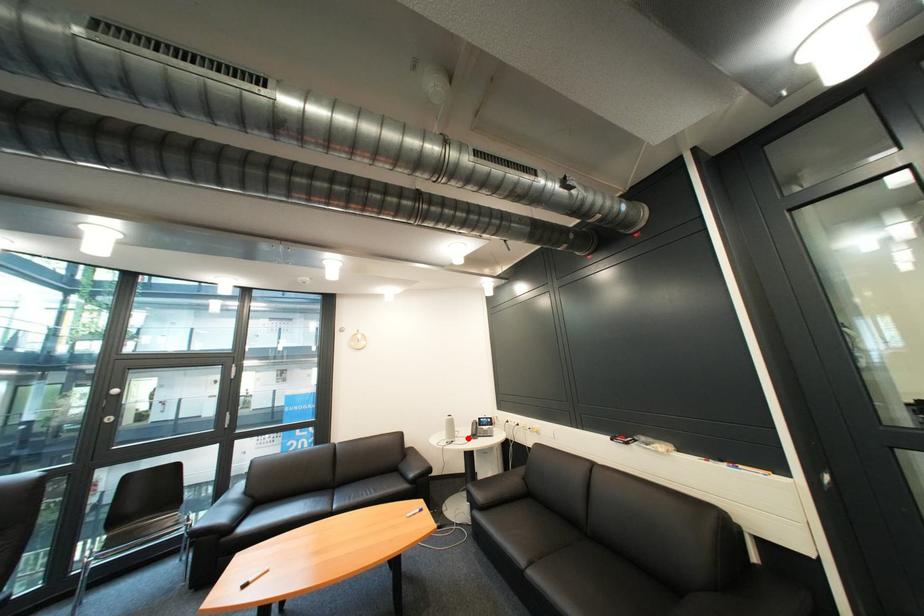
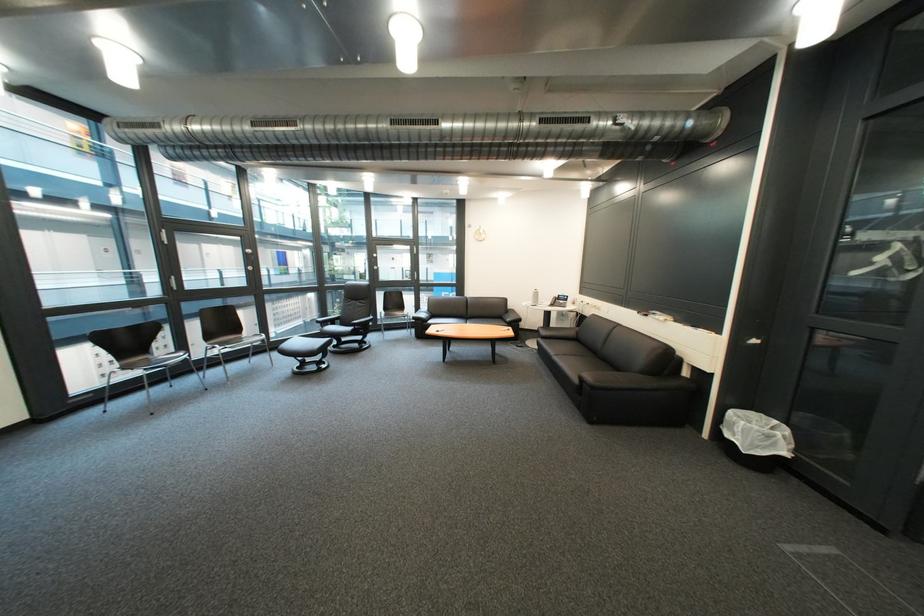
Question: I am providing you with two images of the same scene from different viewpoints. Image1 has a red point marked. In image2, the corresponding 3D location appears at what relative position? Reply with the corresponding letter.

Choices:
 (A) Closer
 (B) Farther

Answer: (A)